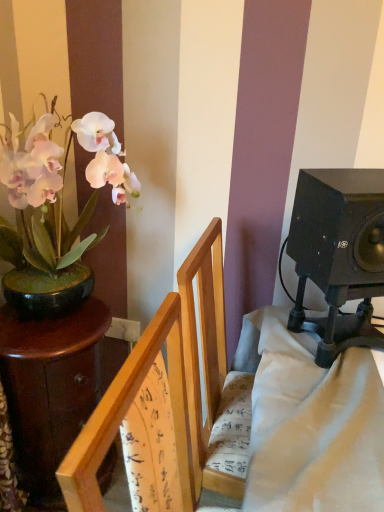
What do you see at coordinates (339, 230) in the screenshot? I see `black matte speaker at right` at bounding box center [339, 230].

Image resolution: width=384 pixels, height=512 pixels. Identify the location of dark brown wooden table at left. (50, 386).

This screenshot has width=384, height=512. What do you see at coordinates (169, 385) in the screenshot?
I see `wooden chair at center` at bounding box center [169, 385].

Image resolution: width=384 pixels, height=512 pixels. Identify the location of black matte speaker at right. (339, 230).

Based on the photo, from a real-world perspective, between white matte orchid at left and black matte speaker at right, who is vertically higher?

In real-world perspective, white matte orchid at left is above.

Is white matte orchid at left turned away from black matte speaker at right?

No, white matte orchid at left's orientation is not away from black matte speaker at right.

Is point (27, 207) closer to camera compared to point (357, 233)?

No, it is behind (357, 233).

Is point (98, 372) closer to viewer compared to point (220, 318)?

No, it is behind (220, 318).

From the image's perspective, which one is positioned higher, dark brown wooden table at left or wooden chair at center?

wooden chair at center appears higher in the image.

In order to click on furniture above the dark brown wooden table at left (from the image's perspective) in this screenshot , I will do `click(169, 385)`.

Who is bigger, dark brown wooden table at left or wooden chair at center?

wooden chair at center.

From the image's perspective, is wooden chair at center above or below black matte speaker at right?

From the image's perspective, wooden chair at center appears below black matte speaker at right.

Which of these two, wooden chair at center or black matte speaker at right, is wider?

Wider between the two is wooden chair at center.

Considering the sizes of wooden chair at center and black matte speaker at right in the image, is wooden chair at center taller or shorter than black matte speaker at right?

Clearly, wooden chair at center is taller compared to black matte speaker at right.

Is wooden chair at center directly adjacent to black matte speaker at right?

No.

Is point (136, 391) positioned behind point (50, 359)?

No, it is not.

From the image's perspective, is wooden chair at center located above or below dark brown wooden table at left?

From the image's perspective, wooden chair at center appears above dark brown wooden table at left.

Is wooden chair at center bigger than dark brown wooden table at left?

Yes.

From the image's perspective, is black matte speaker at right above or below dark brown wooden table at left?

black matte speaker at right is situated higher than dark brown wooden table at left in the image.

From a real-world perspective, is black matte speaker at right physically above dark brown wooden table at left?

Yes, from a real-world perspective, black matte speaker at right is on top of dark brown wooden table at left.

Which object is thinner, black matte speaker at right or dark brown wooden table at left?

Thinner between the two is black matte speaker at right.

Consider the image. How distant is black matte speaker at right from dark brown wooden table at left?

black matte speaker at right is 83.43 centimeters from dark brown wooden table at left.

Does black matte speaker at right appear on the left side of wooden chair at center?

Incorrect, black matte speaker at right is not on the left side of wooden chair at center.

Is black matte speaker at right next to wooden chair at center?

black matte speaker at right and wooden chair at center are not in contact.

From the image's perspective, does black matte speaker at right appear lower than wooden chair at center?

No, from the image's perspective, black matte speaker at right is not below wooden chair at center.

Is wooden chair at center at the back of black matte speaker at right?

No, black matte speaker at right is not facing away from wooden chair at center.

Considering the relative positions of white matte orchid at left and wooden chair at center in the image provided, is white matte orchid at left to the left of wooden chair at center from the viewer's perspective?

Yes.

Which of these two, white matte orchid at left or wooden chair at center, is bigger?

wooden chair at center is bigger.

Considering the points (60, 167) and (154, 355), which point is in front, point (60, 167) or point (154, 355)?

Positioned in front is point (154, 355).

Choose the correct answer: Is white matte orchid at left inside wooden chair at center or outside it?

white matte orchid at left is outside wooden chair at center.

In the image, there is a white matte orchid at left. Where is `loudspeaker below it (from the image's perspective)`? The image size is (384, 512). loudspeaker below it (from the image's perspective) is located at coordinates (339, 230).

Where is `table behind the wooden chair at center`? This screenshot has height=512, width=384. table behind the wooden chair at center is located at coordinates (50, 386).

Estimate the real-world distances between objects in this image. Which object is further from wooden chair at center, dark brown wooden table at left or black matte speaker at right?

dark brown wooden table at left.

Looking at this image, when comparing their distances from black matte speaker at right, does dark brown wooden table at left or wooden chair at center seem closer?

wooden chair at center lies closer to black matte speaker at right than the other object.

Looking at the image, which one is located further to white matte orchid at left, black matte speaker at right or wooden chair at center?

black matte speaker at right lies further to white matte orchid at left than the other object.

Considering their positions, is black matte speaker at right positioned further to white matte orchid at left than dark brown wooden table at left?

black matte speaker at right is further to white matte orchid at left.

Based on their spatial positions, is black matte speaker at right or wooden chair at center closer to dark brown wooden table at left?

wooden chair at center.

Looking at the image, which one is located further to dark brown wooden table at left, wooden chair at center or white matte orchid at left?

The object further to dark brown wooden table at left is wooden chair at center.

From the image, which object appears to be nearer to white matte orchid at left, dark brown wooden table at left or wooden chair at center?

dark brown wooden table at left.

Based on their spatial positions, is black matte speaker at right or white matte orchid at left further from wooden chair at center?

The object further to wooden chair at center is white matte orchid at left.

Where is `houseplant located between dark brown wooden table at left and black matte speaker at right in the left-right direction`? Image resolution: width=384 pixels, height=512 pixels. houseplant located between dark brown wooden table at left and black matte speaker at right in the left-right direction is located at coordinates (57, 190).

I want to click on furniture between white matte orchid at left and black matte speaker at right from left to right, so click(x=169, y=385).

Image resolution: width=384 pixels, height=512 pixels. Identify the location of furniture situated between dark brown wooden table at left and black matte speaker at right from left to right. (169, 385).

At what (x,y) coordinates should I click in order to perform the action: click on houseplant between wooden chair at center and dark brown wooden table at left from front to back. Please return your answer as a coordinate pair (x, y). This screenshot has width=384, height=512. Looking at the image, I should click on (57, 190).